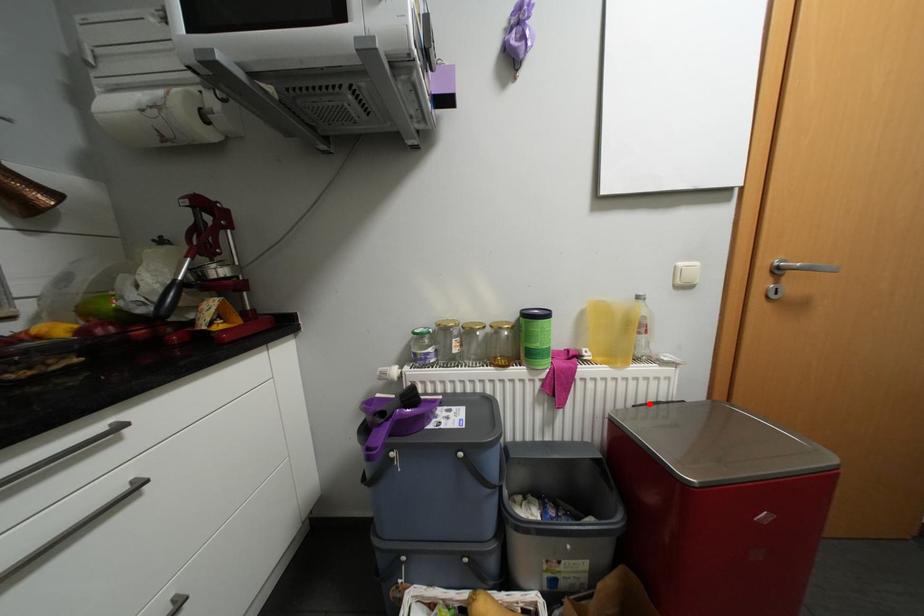
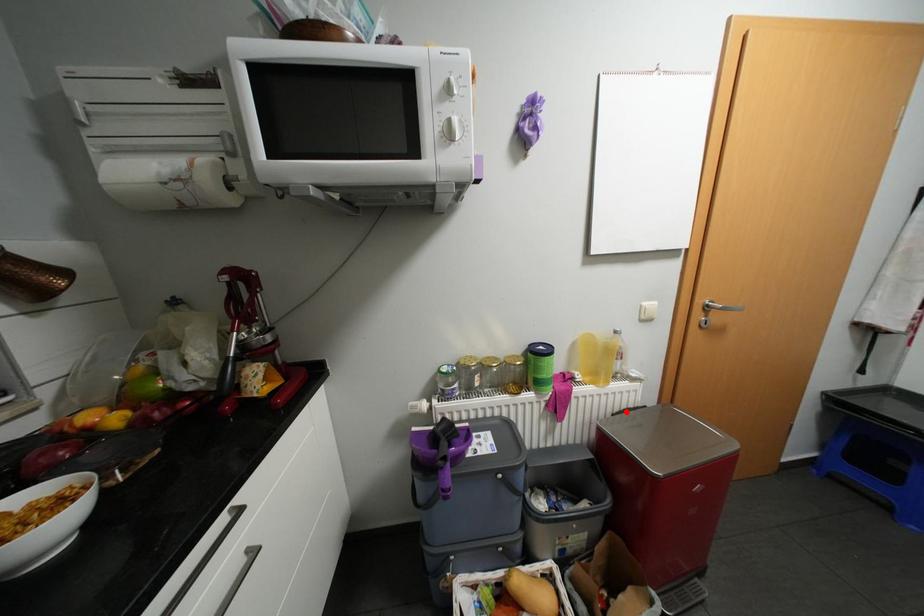
I am providing you with two images of the same scene from different viewpoints. A red point is marked on the first image and another point is marked on the second image. Are the points marked in image1 and image2 representing the same 3D position?

Yes